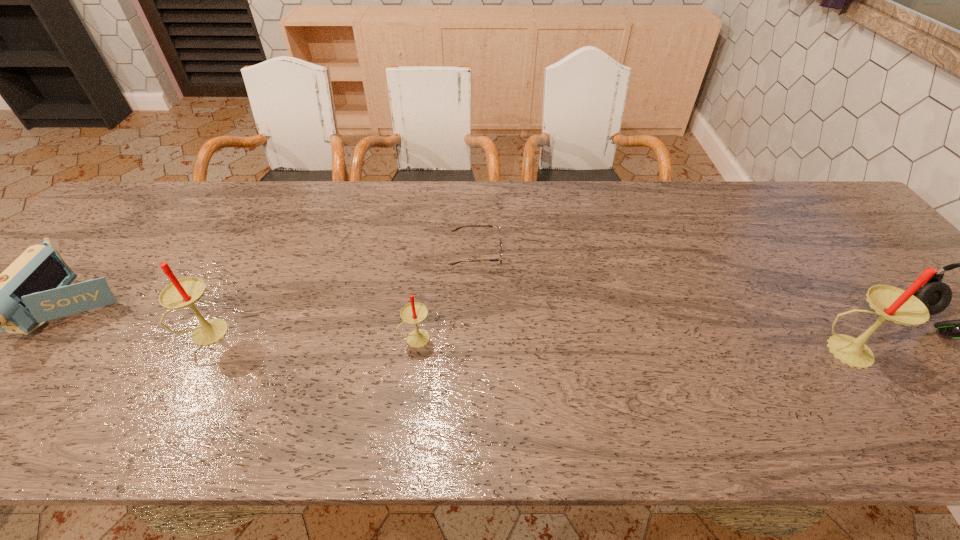
Please point a space for a new candle to maintain equal intervals. Please provide its 2D coordinates. Your answer should be formatted as a tuple, i.e. [(x, y)], where the tuple contains the x and y coordinates of a point satisfying the conditions above.

[(628, 345)]